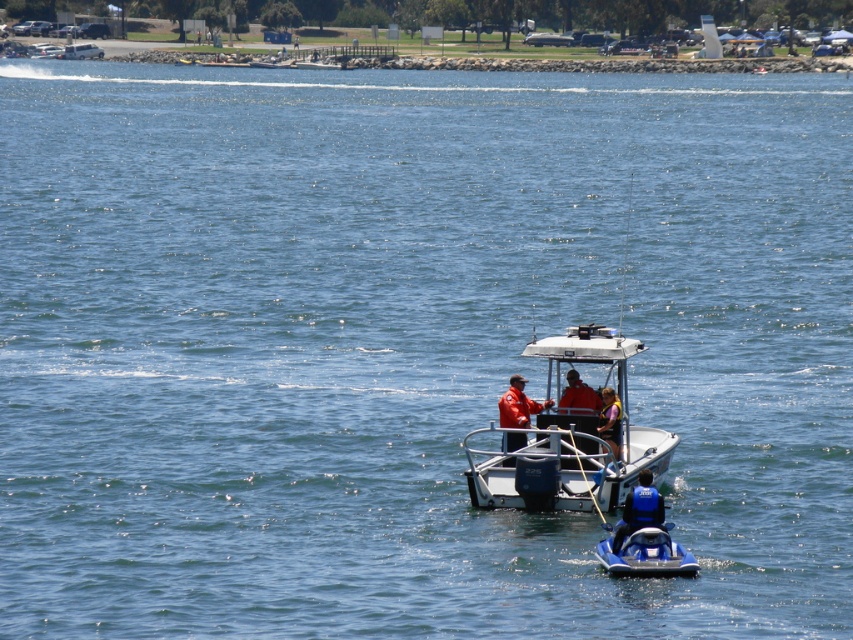
Find the location of `blue glossy jet ski at center`. blue glossy jet ski at center is located at coordinates (646, 554).

Based on the photo, who is lower down, blue glossy jet ski at center or blue fabric life vest at lower center?

blue glossy jet ski at center is lower down.

Between point (685, 556) and point (642, 477), which one is positioned in front?

Point (685, 556) is more forward.

This screenshot has width=853, height=640. What are the coordinates of `blue glossy jet ski at center` in the screenshot? It's located at (646, 554).

Which of these two, orange life vest at center or orange fabric life vest at center, stands taller?

With more height is orange life vest at center.

Can you confirm if orange life vest at center is shorter than orange fabric life vest at center?

In fact, orange life vest at center may be taller than orange fabric life vest at center.

This screenshot has height=640, width=853. What do you see at coordinates (518, 404) in the screenshot?
I see `orange life vest at center` at bounding box center [518, 404].

At what (x,y) coordinates should I click in order to perform the action: click on orange life vest at center. Please return your answer as a coordinate pair (x, y). The image size is (853, 640). Looking at the image, I should click on (518, 404).

Is silver metallic boat at center wider than purple fabric life vest at center?

Yes, silver metallic boat at center is wider than purple fabric life vest at center.

Is silver metallic boat at center further to camera compared to purple fabric life vest at center?

That is False.

Where is `silver metallic boat at center`? silver metallic boat at center is located at coordinates (567, 436).

Locate an element on the screen. silver metallic boat at center is located at coordinates (567, 436).